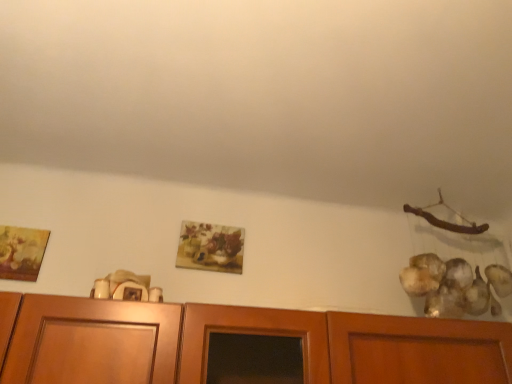
Find the location of a particular element. This screenshot has width=512, height=384. matte gold picture frame at left, which appears as the first picture frame when viewed from the left is located at coordinates (21, 252).

The width and height of the screenshot is (512, 384). What do you see at coordinates (21, 252) in the screenshot?
I see `matte gold picture frame at left, which appears as the first picture frame when viewed from the left` at bounding box center [21, 252].

The height and width of the screenshot is (384, 512). What do you see at coordinates (210, 247) in the screenshot?
I see `matte floral print at center, the 2th picture frame positioned from the left` at bounding box center [210, 247].

Find the location of a particular element. This screenshot has width=512, height=384. matte floral print at center, which is the second picture frame in front-to-back order is located at coordinates (210, 247).

You are a GUI agent. You are given a task and a screenshot of the screen. Output one action in this format:
    pyautogui.click(x=<x>, y=<y>)
    Task: Click on the matte gold picture frame at left, which is counted as the second picture frame, starting from the right
    The image size is (512, 384).
    Given the screenshot: What is the action you would take?
    pyautogui.click(x=21, y=252)

Considering the relative positions of matte floral print at center, placed as the 1th picture frame when sorted from back to front, and matte gold picture frame at left, placed as the 2th picture frame when sorted from back to front, in the image provided, is matte floral print at center, placed as the 1th picture frame when sorted from back to front, to the left of matte gold picture frame at left, placed as the 2th picture frame when sorted from back to front, from the viewer's perspective?

In fact, matte floral print at center, placed as the 1th picture frame when sorted from back to front, is to the right of matte gold picture frame at left, placed as the 2th picture frame when sorted from back to front.

Which is in front, matte floral print at center, which is counted as the 1th picture frame, starting from the right, or matte gold picture frame at left, placed as the 2th picture frame when sorted from back to front?

Positioned in front is matte gold picture frame at left, placed as the 2th picture frame when sorted from back to front.

Considering the points (225, 245) and (5, 252), which point is in front, point (225, 245) or point (5, 252)?

Positioned in front is point (5, 252).

From the image's perspective, is matte floral print at center, the 2th picture frame positioned from the left, on matte gold picture frame at left, placed as the 2th picture frame when sorted from back to front?

No, from the image's perspective, matte floral print at center, the 2th picture frame positioned from the left, is not over matte gold picture frame at left, placed as the 2th picture frame when sorted from back to front.

From a real-world perspective, between matte floral print at center, which is counted as the 1th picture frame, starting from the right, and matte gold picture frame at left, which is counted as the second picture frame, starting from the right, who is vertically higher?

matte floral print at center, which is counted as the 1th picture frame, starting from the right.

Is matte floral print at center, placed as the 1th picture frame when sorted from back to front, wider or thinner than matte gold picture frame at left, which is counted as the second picture frame, starting from the right?

Considering their sizes, matte floral print at center, placed as the 1th picture frame when sorted from back to front, looks slimmer than matte gold picture frame at left, which is counted as the second picture frame, starting from the right.

Between matte floral print at center, the 2th picture frame positioned from the left, and matte gold picture frame at left, which appears as the 1th picture frame when viewed from the front, which one has less height?

matte gold picture frame at left, which appears as the 1th picture frame when viewed from the front, is shorter.

Considering the relative sizes of matte floral print at center, which is counted as the 1th picture frame, starting from the right, and matte gold picture frame at left, which is counted as the second picture frame, starting from the right, in the image provided, is matte floral print at center, which is counted as the 1th picture frame, starting from the right, bigger than matte gold picture frame at left, which is counted as the second picture frame, starting from the right,?

No.

Can matte gold picture frame at left, which is counted as the second picture frame, starting from the right, be found inside matte floral print at center, which is the second picture frame in front-to-back order?

That's incorrect, matte gold picture frame at left, which is counted as the second picture frame, starting from the right, is not inside matte floral print at center, which is the second picture frame in front-to-back order.

Is matte floral print at center, which is counted as the 1th picture frame, starting from the right, not close to matte gold picture frame at left, which appears as the first picture frame when viewed from the left?

No, matte floral print at center, which is counted as the 1th picture frame, starting from the right, is not far away from matte gold picture frame at left, which appears as the first picture frame when viewed from the left.

Is matte floral print at center, placed as the 1th picture frame when sorted from back to front, facing towards matte gold picture frame at left, which appears as the first picture frame when viewed from the left?

No, matte floral print at center, placed as the 1th picture frame when sorted from back to front, is not oriented towards matte gold picture frame at left, which appears as the first picture frame when viewed from the left.

Locate an element on the screen. The width and height of the screenshot is (512, 384). picture frame above the matte floral print at center, which is the second picture frame in front-to-back order (from the image's perspective) is located at coordinates (21, 252).

Visually, is matte gold picture frame at left, which appears as the 1th picture frame when viewed from the front, positioned to the left or to the right of matte floral print at center, placed as the 1th picture frame when sorted from back to front?

In the image, matte gold picture frame at left, which appears as the 1th picture frame when viewed from the front, appears on the left side of matte floral print at center, placed as the 1th picture frame when sorted from back to front.

Is matte gold picture frame at left, placed as the 2th picture frame when sorted from back to front, further to camera compared to matte floral print at center, placed as the 1th picture frame when sorted from back to front?

No, it is not.

Which is behind, point (13, 245) or point (227, 272)?

Point (227, 272)

From the image's perspective, is matte gold picture frame at left, which appears as the 1th picture frame when viewed from the front, below matte floral print at center, the 2th picture frame positioned from the left?

Actually, matte gold picture frame at left, which appears as the 1th picture frame when viewed from the front, appears above matte floral print at center, the 2th picture frame positioned from the left, in the image.

Based on the photo, from a real-world perspective, who is located lower, matte gold picture frame at left, placed as the 2th picture frame when sorted from back to front, or matte floral print at center, which is counted as the 1th picture frame, starting from the right?

matte gold picture frame at left, placed as the 2th picture frame when sorted from back to front.

Looking at this image, which of these two, matte gold picture frame at left, placed as the 2th picture frame when sorted from back to front, or matte floral print at center, which is counted as the 1th picture frame, starting from the right, is wider?

With larger width is matte gold picture frame at left, placed as the 2th picture frame when sorted from back to front.

In terms of height, does matte gold picture frame at left, which appears as the 1th picture frame when viewed from the front, look taller or shorter compared to matte floral print at center, which is counted as the 1th picture frame, starting from the right?

matte gold picture frame at left, which appears as the 1th picture frame when viewed from the front, is shorter than matte floral print at center, which is counted as the 1th picture frame, starting from the right.

Considering the relative sizes of matte gold picture frame at left, placed as the 2th picture frame when sorted from back to front, and matte floral print at center, which is the second picture frame in front-to-back order, in the image provided, is matte gold picture frame at left, placed as the 2th picture frame when sorted from back to front, smaller than matte floral print at center, which is the second picture frame in front-to-back order,?

Incorrect, matte gold picture frame at left, placed as the 2th picture frame when sorted from back to front, is not smaller in size than matte floral print at center, which is the second picture frame in front-to-back order.

Is matte floral print at center, placed as the 1th picture frame when sorted from back to front, located within matte gold picture frame at left, which is counted as the second picture frame, starting from the right?

No, matte floral print at center, placed as the 1th picture frame when sorted from back to front, is not inside matte gold picture frame at left, which is counted as the second picture frame, starting from the right.

Consider the image. Is matte gold picture frame at left, which is counted as the second picture frame, starting from the right, not near matte floral print at center, the 2th picture frame positioned from the left?

They are positioned close to each other.

Is matte gold picture frame at left, which appears as the first picture frame when viewed from the left, turned away from matte floral print at center, which is the second picture frame in front-to-back order?

No, matte gold picture frame at left, which appears as the first picture frame when viewed from the left,'s orientation is not away from matte floral print at center, which is the second picture frame in front-to-back order.

In the scene shown: How far apart are matte gold picture frame at left, which is counted as the second picture frame, starting from the right, and matte floral print at center, which is the second picture frame in front-to-back order?

A distance of 21.84 inches exists between matte gold picture frame at left, which is counted as the second picture frame, starting from the right, and matte floral print at center, which is the second picture frame in front-to-back order.

What are the coordinates of `picture frame located underneath the matte floral print at center, which is counted as the 1th picture frame, starting from the right (from a real-world perspective)` in the screenshot? It's located at (21, 252).

Locate an element on the screen. The width and height of the screenshot is (512, 384). picture frame below the matte gold picture frame at left, placed as the 2th picture frame when sorted from back to front (from the image's perspective) is located at coordinates (210, 247).

Identify the location of picture frame that appears below the matte floral print at center, which is the second picture frame in front-to-back order (from a real-world perspective). This screenshot has width=512, height=384. (21, 252).